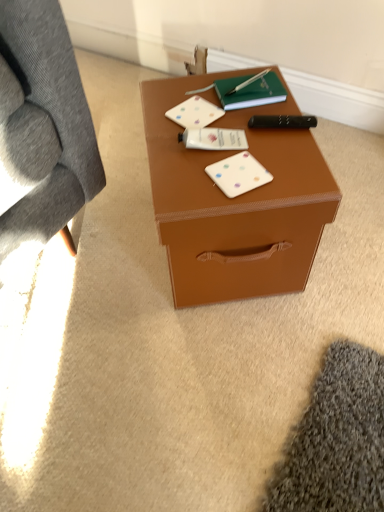
The image size is (384, 512). I want to click on green matte notebook at upper center, so click(250, 91).

The image size is (384, 512). What are the coordinates of `brown matte box at center` in the screenshot? It's located at (235, 204).

This screenshot has width=384, height=512. What are the coordinates of `white matte card game at center, which is counted as the 1th card game, starting from the top` in the screenshot? It's located at (195, 113).

Find the location of a particular element. The width and height of the screenshot is (384, 512). green matte notebook at upper center is located at coordinates (250, 91).

Are black plastic remote control at right and white matte card game at center, positioned as the first card game in front-to-back order, beside each other?

No, black plastic remote control at right is not making contact with white matte card game at center, positioned as the first card game in front-to-back order.

Can you confirm if black plastic remote control at right is smaller than white matte card game at center, which ranks as the 2th card game in back-to-front order?

No.

From the image's perspective, is black plastic remote control at right over white matte card game at center, placed as the 2th card game when sorted from top to bottom?

Indeed, from the image's perspective, black plastic remote control at right is shown above white matte card game at center, placed as the 2th card game when sorted from top to bottom.

Considering the sizes of objects black plastic remote control at right and brown matte box at center in the image provided, who is wider, black plastic remote control at right or brown matte box at center?

brown matte box at center.

From a real-world perspective, is black plastic remote control at right above or below brown matte box at center?

Clearly, from a real-world perspective, black plastic remote control at right is above brown matte box at center.

Does black plastic remote control at right come in front of brown matte box at center?

No, black plastic remote control at right is further to the viewer.

Choose the correct answer: Is black plastic remote control at right inside brown matte box at center or outside it?

black plastic remote control at right exists outside the volume of brown matte box at center.

Can green matte notebook at upper center be found inside brown matte box at center?

Yes.

From the image's perspective, which is below, brown matte box at center or green matte notebook at upper center?

brown matte box at center appears lower in the image.

From a real-world perspective, is brown matte box at center physically below green matte notebook at upper center?

Yes.

From a real-world perspective, which object rests below the other?

white matte card game at center, acting as the second card game starting from the front, is physically lower.

Considering the sizes of objects green matte notebook at upper center and white matte card game at center, which is counted as the 1th card game, starting from the top, in the image provided, who is shorter, green matte notebook at upper center or white matte card game at center, which is counted as the 1th card game, starting from the top,?

white matte card game at center, which is counted as the 1th card game, starting from the top.

Considering the positions of objects green matte notebook at upper center and white matte card game at center, placed as the second card game when sorted from bottom to top, in the image provided, who is in front, green matte notebook at upper center or white matte card game at center, placed as the second card game when sorted from bottom to top,?

Positioned in front is white matte card game at center, placed as the second card game when sorted from bottom to top.

Could you measure the distance between green matte notebook at upper center and white matte card game at center, which is counted as the 1th card game, starting from the top?

green matte notebook at upper center and white matte card game at center, which is counted as the 1th card game, starting from the top, are 3.38 inches apart.

Based on the photo, which object is more forward, white matte card game at center, the first card game in the back-to-front sequence, or white matte card game at center, which is the 1th card game in bottom-to-top order?

Positioned in front is white matte card game at center, which is the 1th card game in bottom-to-top order.

Measure the distance between white matte card game at center, acting as the second card game starting from the front, and white matte card game at center, placed as the 2th card game when sorted from top to bottom.

white matte card game at center, acting as the second card game starting from the front, is 6.97 inches from white matte card game at center, placed as the 2th card game when sorted from top to bottom.

What's the angular difference between white matte card game at center, placed as the second card game when sorted from bottom to top, and white matte card game at center, placed as the 2th card game when sorted from top to bottom,'s facing directions?

99.1 degrees separate the facing orientations of white matte card game at center, placed as the second card game when sorted from bottom to top, and white matte card game at center, placed as the 2th card game when sorted from top to bottom.

From the image's perspective, is white matte card game at center, acting as the second card game starting from the front, below white matte card game at center, positioned as the first card game in front-to-back order?

Actually, white matte card game at center, acting as the second card game starting from the front, appears above white matte card game at center, positioned as the first card game in front-to-back order, in the image.

Measure the distance between brown matte box at center and black plastic remote control at right.

brown matte box at center and black plastic remote control at right are 9.51 inches apart from each other.

Which is farther from the camera, (332, 219) or (258, 126)?

The point (258, 126) is farther.

Is black plastic remote control at right at the back of brown matte box at center?

brown matte box at center is not turned away from black plastic remote control at right.

The width and height of the screenshot is (384, 512). In order to click on table in front of the black plastic remote control at right in this screenshot , I will do `click(235, 204)`.

From the image's perspective, is brown matte box at center beneath white matte card game at center, which is counted as the 1th card game, starting from the top?

Yes.

From the picture: Which of these two, brown matte box at center or white matte card game at center, placed as the second card game when sorted from bottom to top, is smaller?

white matte card game at center, placed as the second card game when sorted from bottom to top, is smaller.

Are brown matte box at center and white matte card game at center, acting as the second card game starting from the front, making contact?

No, brown matte box at center is not with white matte card game at center, acting as the second card game starting from the front.

Where is `card game in front of the black plastic remote control at right`? This screenshot has height=512, width=384. card game in front of the black plastic remote control at right is located at coordinates (238, 174).

Where is `table to the left of black plastic remote control at right`? table to the left of black plastic remote control at right is located at coordinates (235, 204).

From the image, which object appears to be nearer to black plastic remote control at right, white matte card game at center, placed as the second card game when sorted from bottom to top, or green matte notebook at upper center?

green matte notebook at upper center lies closer to black plastic remote control at right than the other object.

From the image, which object appears to be nearer to black plastic remote control at right, green matte notebook at upper center or brown matte box at center?

The object closer to black plastic remote control at right is green matte notebook at upper center.

Looking at the image, which one is located further to white matte card game at center, which is the 1th card game in bottom-to-top order, brown matte box at center or black plastic remote control at right?

Among the two, black plastic remote control at right is located further to white matte card game at center, which is the 1th card game in bottom-to-top order.

When comparing their distances from black plastic remote control at right, does white matte card game at center, which ranks as the 2th card game in back-to-front order, or green matte notebook at upper center seem further?

The object further to black plastic remote control at right is white matte card game at center, which ranks as the 2th card game in back-to-front order.

Consider the image. Based on their spatial positions, is brown matte box at center or white matte card game at center, acting as the second card game starting from the front, closer to black plastic remote control at right?

white matte card game at center, acting as the second card game starting from the front.

Which object lies further to the anchor point black plastic remote control at right, green matte notebook at upper center or white matte card game at center, the first card game in the back-to-front sequence?

Based on the image, white matte card game at center, the first card game in the back-to-front sequence, appears to be further to black plastic remote control at right.

Considering their positions, is brown matte box at center positioned closer to white matte card game at center, acting as the second card game starting from the front, than white matte card game at center, positioned as the first card game in front-to-back order?

white matte card game at center, positioned as the first card game in front-to-back order, is positioned closer to the anchor white matte card game at center, acting as the second card game starting from the front.

Estimate the real-world distances between objects in this image. Which object is closer to white matte card game at center, which is the 1th card game in bottom-to-top order, green matte notebook at upper center or white matte card game at center, placed as the second card game when sorted from bottom to top?

white matte card game at center, placed as the second card game when sorted from bottom to top, is closer to white matte card game at center, which is the 1th card game in bottom-to-top order.

Identify the location of card game that lies between green matte notebook at upper center and white matte card game at center, which is the 1th card game in bottom-to-top order, from top to bottom. The height and width of the screenshot is (512, 384). (195, 113).

Locate an element on the screen. stationery between green matte notebook at upper center and brown matte box at center in the vertical direction is located at coordinates (283, 121).

Where is `table situated between white matte card game at center, placed as the second card game when sorted from bottom to top, and black plastic remote control at right from left to right`? The height and width of the screenshot is (512, 384). table situated between white matte card game at center, placed as the second card game when sorted from bottom to top, and black plastic remote control at right from left to right is located at coordinates (235, 204).

Find the location of a particular element. card game between white matte card game at center, which is counted as the 1th card game, starting from the top, and brown matte box at center, in the vertical direction is located at coordinates point(238,174).